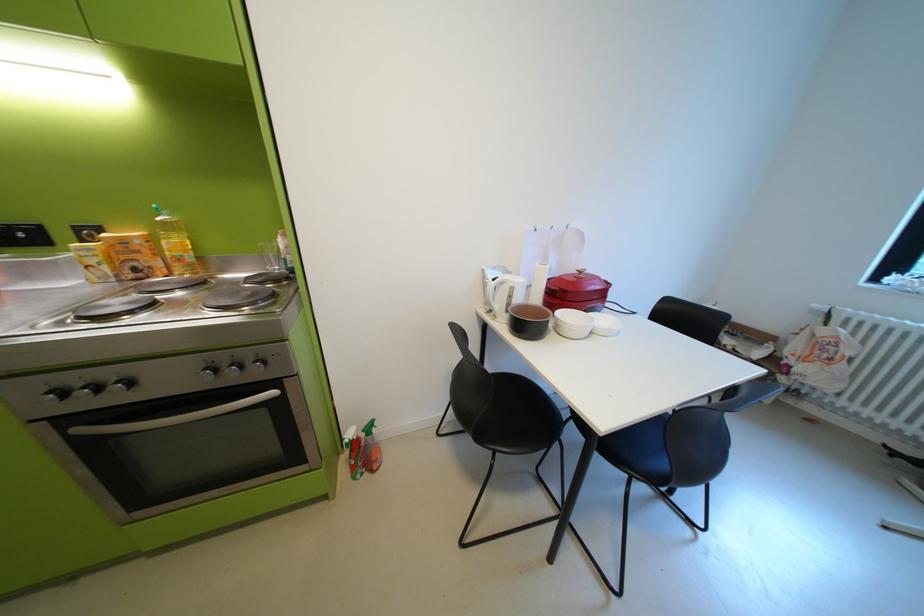
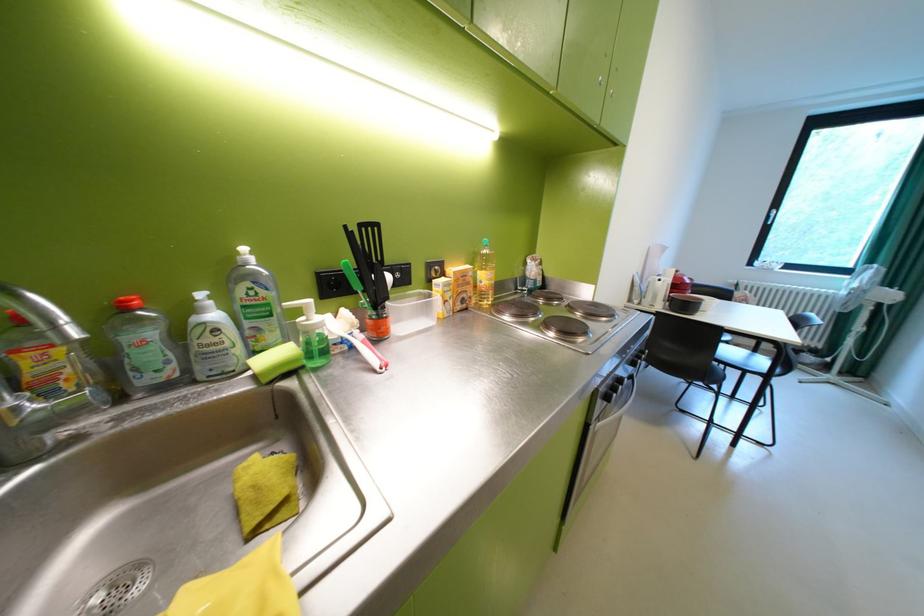
Question: The images are taken continuously from a first-person perspective. In which direction are you moving?

Choices:
 (A) Left
 (B) Right
 (C) Forward
 (D) Backward

Answer: (A)